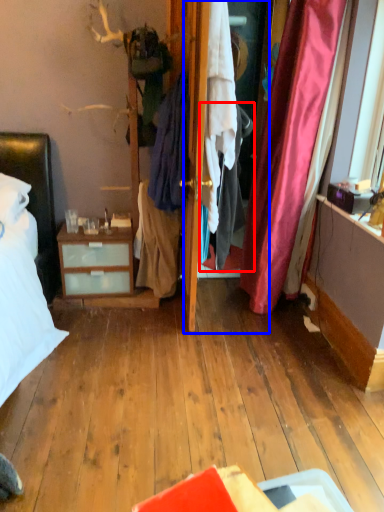
Question: Which point is closer to the camera, clothing (highlighted by a red box) or screen door (highlighted by a blue box)?

Choices:
 (A) clothing
 (B) screen door

Answer: (A)